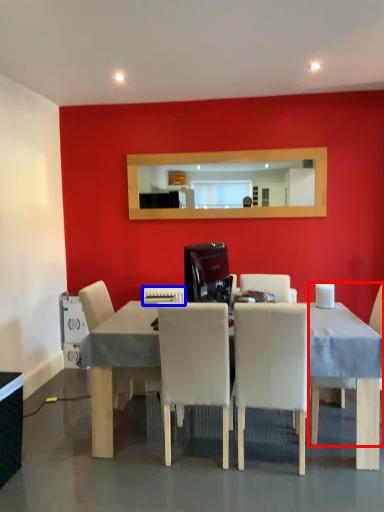
Question: Which point is closer to the camera, chair (highlighted by a red box) or appliance (highlighted by a blue box)?

Choices:
 (A) chair
 (B) appliance

Answer: (A)